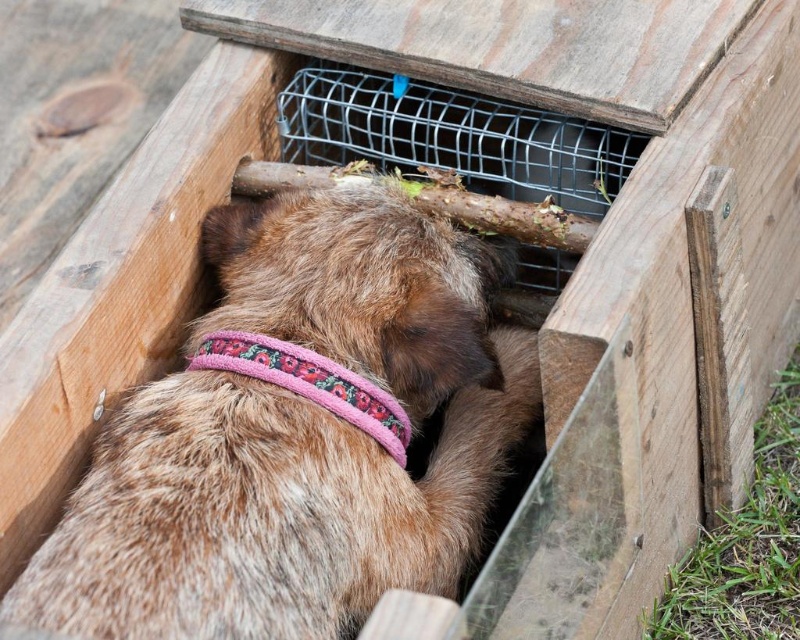
Question: Which of the following is the closest to the observer?

Choices:
 (A) (348, 406)
 (B) (370, 435)

Answer: (A)

Question: Which point is closer to the camera taking this photo?

Choices:
 (A) (332, 568)
 (B) (254, 355)

Answer: (A)

Question: Where is brown furry dog at center located in relation to pink fabric neckband at center in the image?

Choices:
 (A) above
 (B) below

Answer: (B)

Question: Does brown furry dog at center have a lesser width compared to pink fabric neckband at center?

Choices:
 (A) no
 (B) yes

Answer: (A)

Question: Does brown furry dog at center lie in front of pink fabric neckband at center?

Choices:
 (A) no
 (B) yes

Answer: (B)